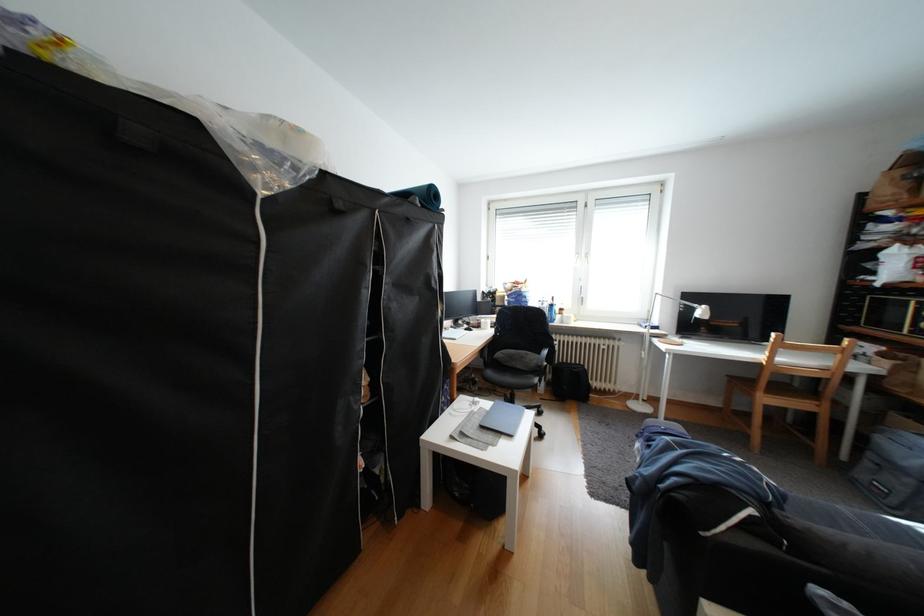
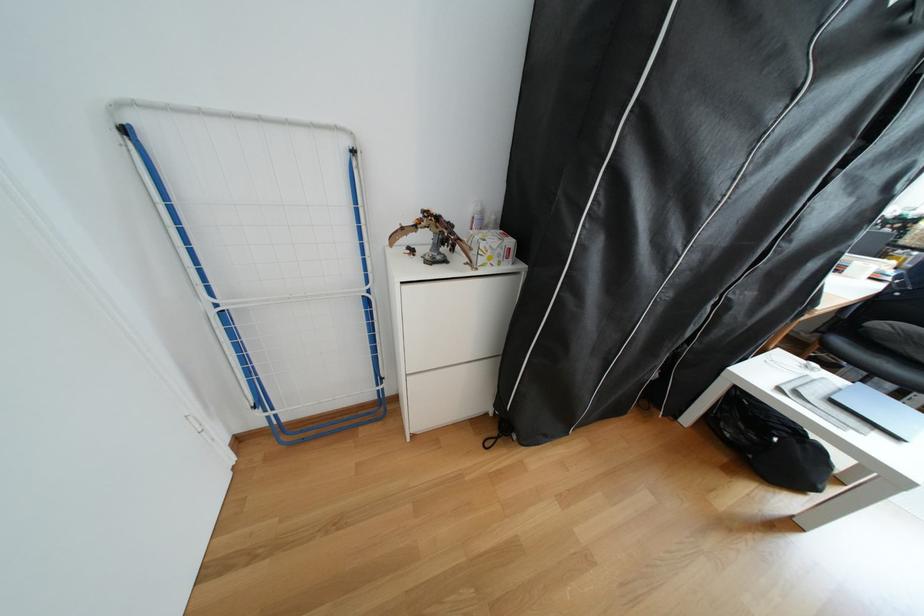
Find the pixel in the second image that matches (x=524, y=437) in the first image.

(908, 439)